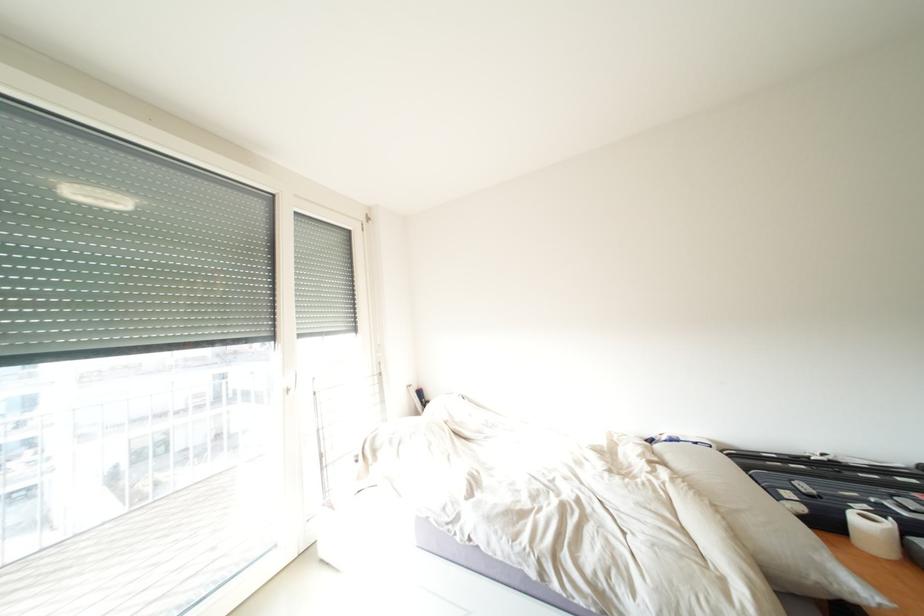
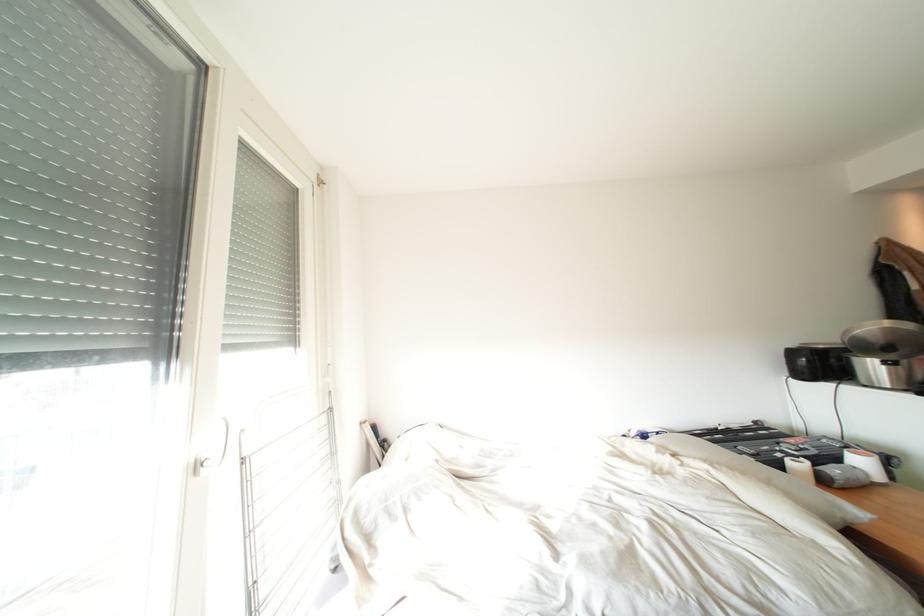
Question: The first image is from the beginning of the video and the second image is from the end. How did the camera likely rotate when shooting the video?

Choices:
 (A) Left
 (B) Right
 (C) Up
 (D) Down

Answer: (B)